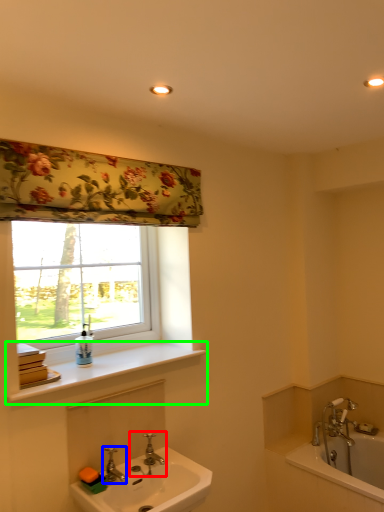
Question: Based on their relative distances, which object is nearer to tap (highlighted by a red box)? Choose from tap (highlighted by a blue box) and window sill (highlighted by a green box).

Choices:
 (A) tap
 (B) window sill

Answer: (A)